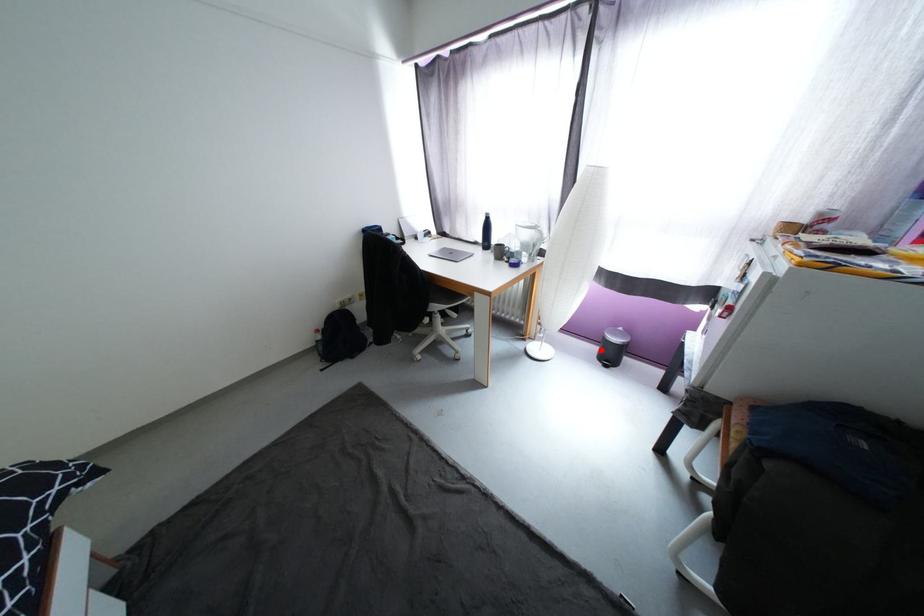
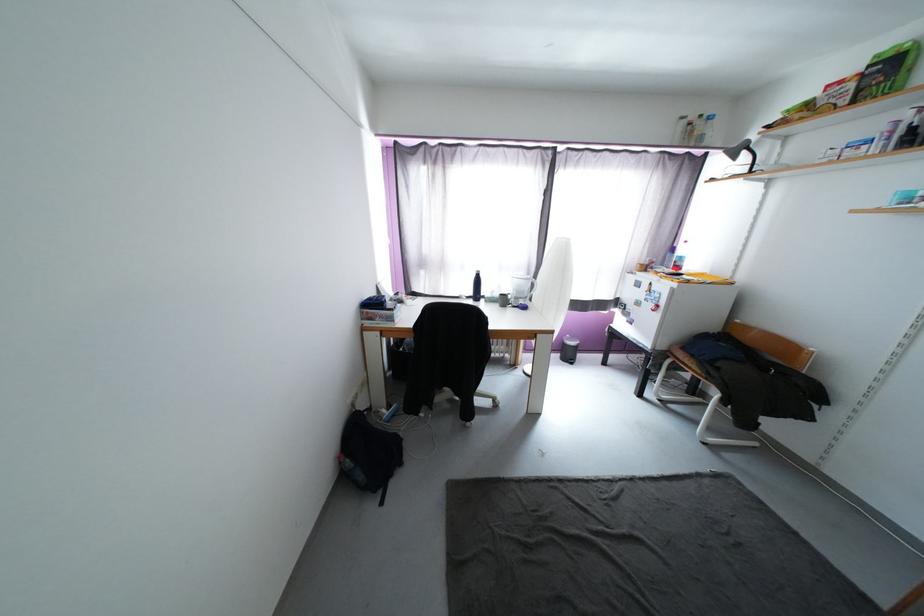
Question: I am providing you with two images of the same scene from different viewpoints. A red point is shown in image1. For the corresponding object point in image2, is it positioned nearer or farther from the camera?

Choices:
 (A) Nearer
 (B) Farther

Answer: (B)